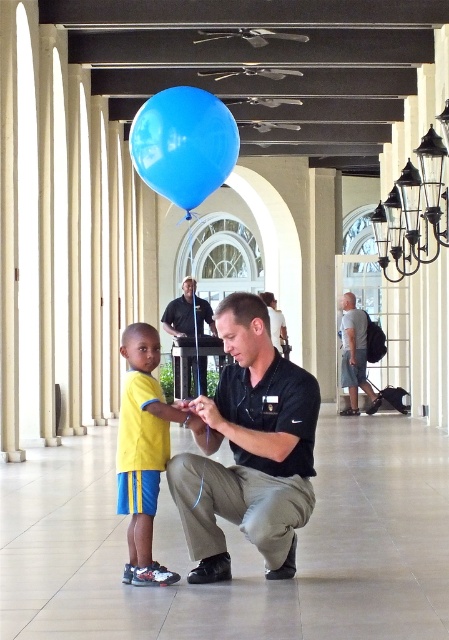
Can you confirm if matte black shirt at center is taller than black matte uniform at center?

Yes, matte black shirt at center is taller than black matte uniform at center.

Who is lower down, matte black shirt at center or black matte uniform at center?

black matte uniform at center is lower down.

The width and height of the screenshot is (449, 640). I want to click on matte black shirt at center, so click(249, 449).

Can you confirm if yellow fabric shirt at center is shorter than gray fabric backpack at center-right?

Yes, yellow fabric shirt at center is shorter than gray fabric backpack at center-right.

Is yellow fabric shirt at center thinner than gray fabric backpack at center-right?

Indeed, yellow fabric shirt at center has a lesser width compared to gray fabric backpack at center-right.

Measure the distance between yellow fabric shirt at center and camera.

yellow fabric shirt at center and camera are 7.73 meters apart from each other.

The image size is (449, 640). In order to click on yellow fabric shirt at center in this screenshot , I will do `click(142, 451)`.

Which is more to the left, yellow fabric shirt at center or black matte uniform at center?

black matte uniform at center

Identify the location of yellow fabric shirt at center. (142, 451).